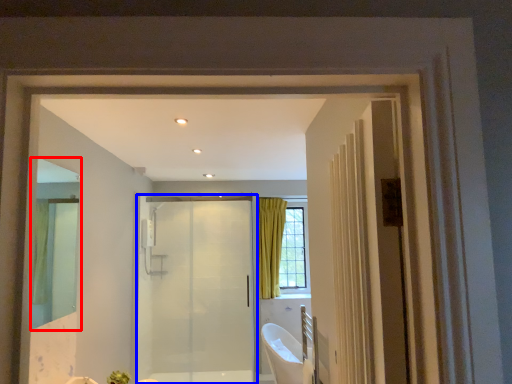
Question: Which object is closer to the camera taking this photo, mirror (highlighted by a red box) or door (highlighted by a blue box)?

Choices:
 (A) mirror
 (B) door

Answer: (A)